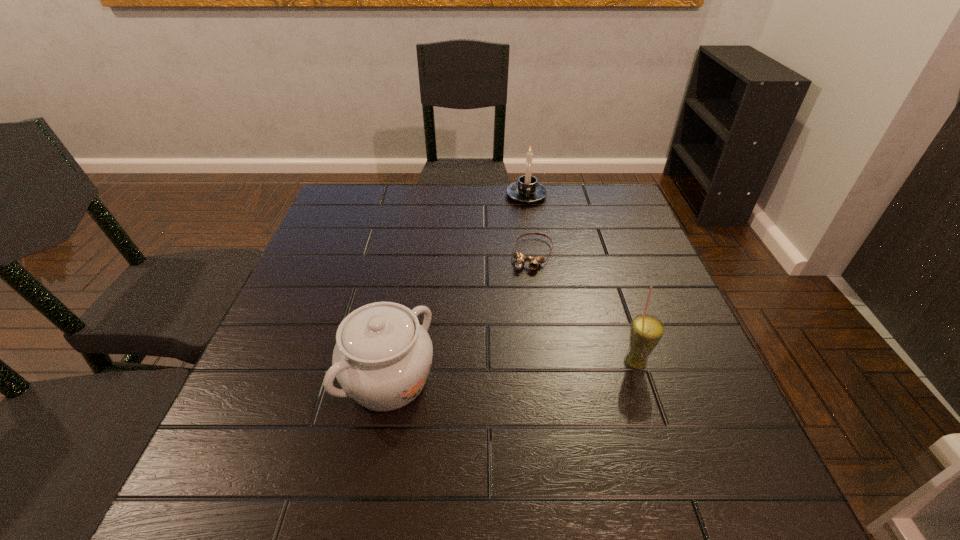
Where is `vacant region located on the front lenses and sides of the second farthest object`? The image size is (960, 540). vacant region located on the front lenses and sides of the second farthest object is located at coordinates (488, 393).

Find the location of a particular element. free space located 0.060m on the front lenses and sides of the second farthest object is located at coordinates point(524,288).

The width and height of the screenshot is (960, 540). Identify the location of free spot located 0.270m on the front lenses and sides of the second farthest object. point(501,353).

This screenshot has width=960, height=540. Find the location of `object that is at the far edge`. object that is at the far edge is located at coordinates point(527,190).

You are a GUI agent. You are given a task and a screenshot of the screen. Output one action in this format:
    pyautogui.click(x=<x>, y=<y>)
    Task: Click on the object that is positioned at the near edge
    
    Given the screenshot: What is the action you would take?
    pyautogui.click(x=382, y=357)

This screenshot has width=960, height=540. Find the location of `object located at the right edge`. object located at the right edge is located at coordinates (646, 331).

Locate an element on the screen. Image resolution: width=960 pixels, height=540 pixels. vacant space at the far edge is located at coordinates (406, 201).

The width and height of the screenshot is (960, 540). In the image, there is a desktop. What are the coordinates of `vacant space at the near edge` in the screenshot? It's located at (510, 410).

Locate an element on the screen. The image size is (960, 540). vacant area at the left edge of the desktop is located at coordinates (276, 360).

Image resolution: width=960 pixels, height=540 pixels. What are the coordinates of `vacant space at the right edge of the desktop` in the screenshot? It's located at (633, 240).